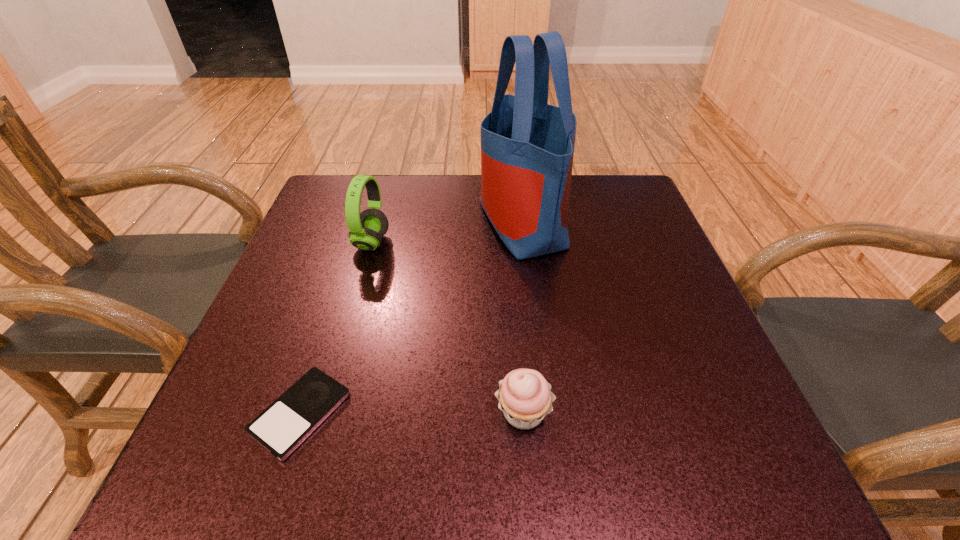
Where is `the tallest object`? the tallest object is located at coordinates (527, 146).

Locate an element on the screen. Image resolution: width=960 pixels, height=540 pixels. headset is located at coordinates (366, 229).

Image resolution: width=960 pixels, height=540 pixels. What are the coordinates of `cupcake` in the screenshot? It's located at (525, 397).

The image size is (960, 540). In order to click on the shortest object in this screenshot , I will do `click(291, 418)`.

Find the location of a particular element. free space located on the left of the handbag is located at coordinates (430, 222).

Find the location of a particular element. This screenshot has height=540, width=960. free space located 0.070m on the left of the headset is located at coordinates (324, 242).

Where is `vacant point located 0.150m on the right of the third tallest object`? This screenshot has width=960, height=540. vacant point located 0.150m on the right of the third tallest object is located at coordinates (647, 412).

I want to click on free space located 0.070m on the left of the shortest object, so click(211, 413).

Image resolution: width=960 pixels, height=540 pixels. I want to click on handbag present at the far edge, so (527, 146).

The width and height of the screenshot is (960, 540). Identify the location of headset that is at the far edge. (366, 229).